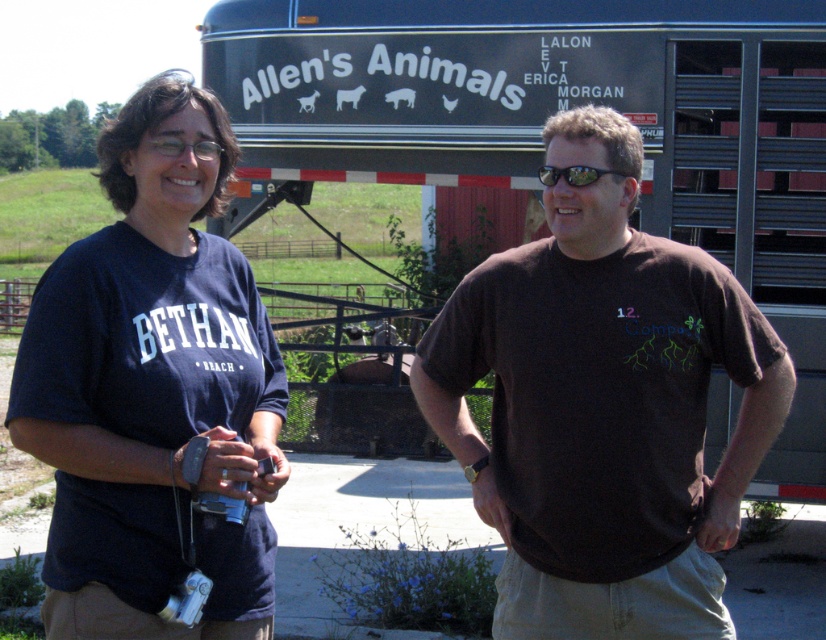
In the scene shown: You are standing in front of the trailer and want to place a sticker on the point that is closer to you. Which point should you choose between point (616, 204) and point (625, 176)?

Point (616, 204) is in front of point (625, 176), so you should choose point (616, 204) as it is closer to you.